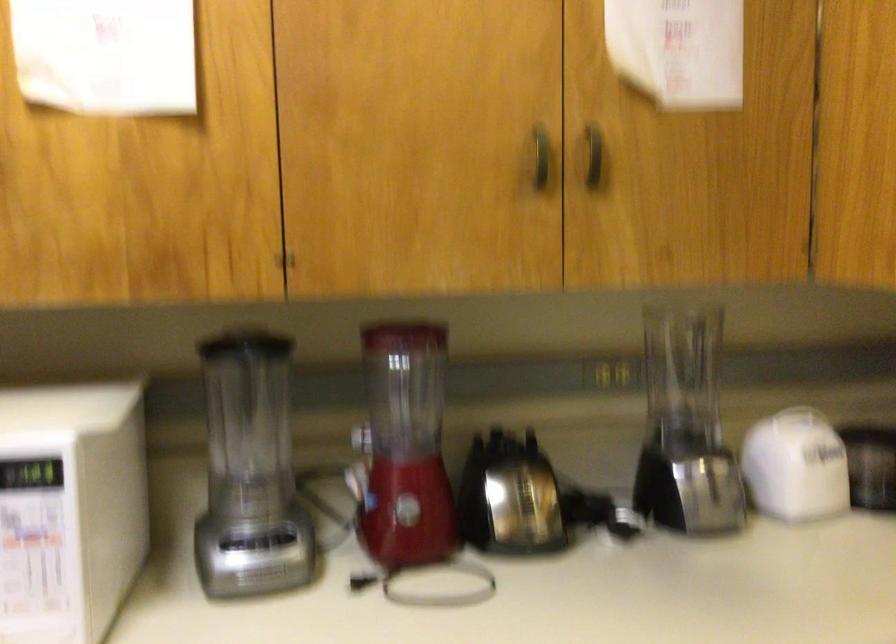
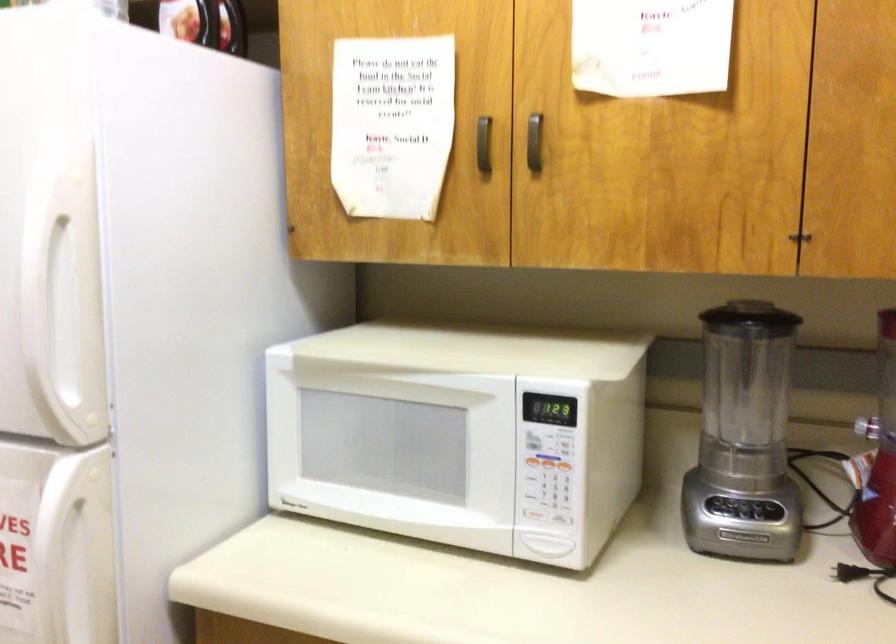
In the second image, find the point that corresponds to point (240, 545) in the first image.

(725, 506)